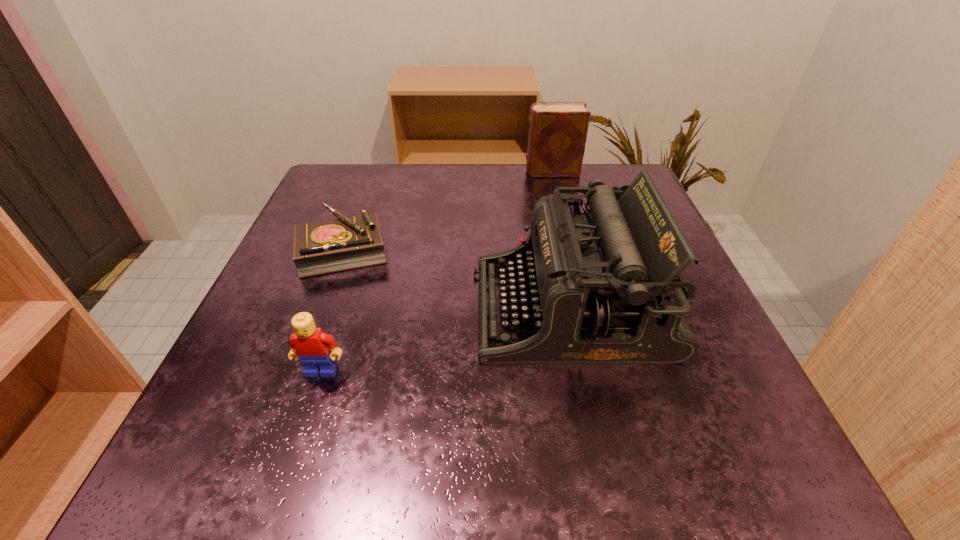
The width and height of the screenshot is (960, 540). In order to click on vacant region at the far edge of the desktop in this screenshot , I will do `click(506, 181)`.

In the image, there is a desktop. In order to click on vacant space at the near edge in this screenshot , I will do `click(490, 484)`.

In the image, there is a desktop. Find the location of `vacant space at the left edge`. vacant space at the left edge is located at coordinates (243, 327).

The width and height of the screenshot is (960, 540). I want to click on free location at the far left corner of the desktop, so [x=368, y=182].

In the image, there is a desktop. At what (x,y) coordinates should I click in order to perform the action: click on vacant space at the far right corner. Please return your answer as a coordinate pair (x, y). Looking at the image, I should click on click(x=576, y=186).

The image size is (960, 540). What are the coordinates of `free space between the farther diary and the shortest object` in the screenshot? It's located at (447, 211).

Where is `vacant area that lies between the Lego and the tallest object`? vacant area that lies between the Lego and the tallest object is located at coordinates (446, 340).

Find the location of a particular element. unoccupied position between the left diary and the Lego is located at coordinates (332, 310).

Where is `vacant area that lies between the shortest object and the farthest object`? Image resolution: width=960 pixels, height=540 pixels. vacant area that lies between the shortest object and the farthest object is located at coordinates [x=447, y=211].

At what (x,y) coordinates should I click in order to perform the action: click on free spot between the Lego and the shorter diary. Please return your answer as a coordinate pair (x, y). The image size is (960, 540). Looking at the image, I should click on (332, 310).